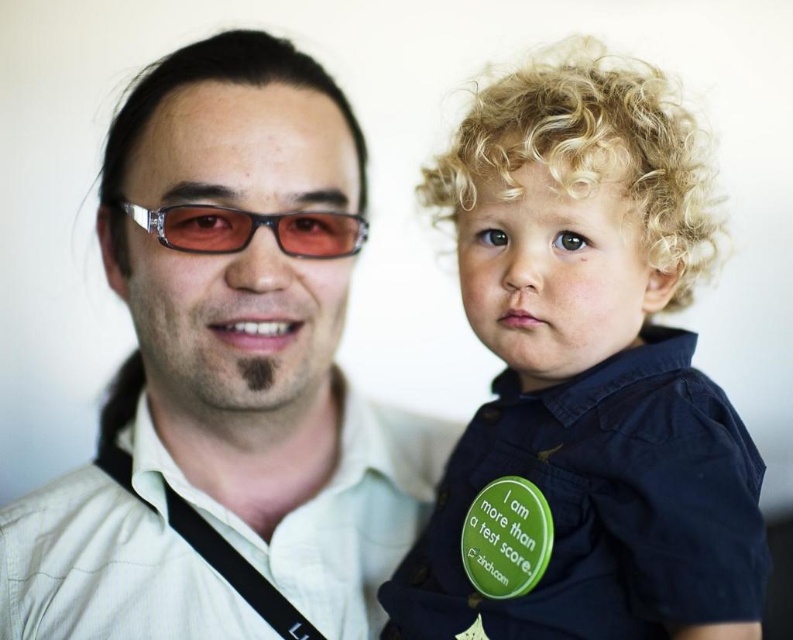
You are a photographer trying to capture a candid shot of the matte white shirt at center and the sunglasses at left. Since you want to ensure both are in focus, you need to know their positions relative to each other. Which object is positioned to the left of the other?

The matte white shirt at center is to the left of sunglasses at left.

You are a photographer trying to capture a portrait of the adult and child in the scene. You notice the white textured shirt at center and sunglasses at left. Which object should you focus on first if you want to ensure both subjects are in sharp focus?

The white textured shirt at center is positioned under sunglasses at left, so focusing on the sunglasses at left first would ensure both are in focus since it is closer to the camera.